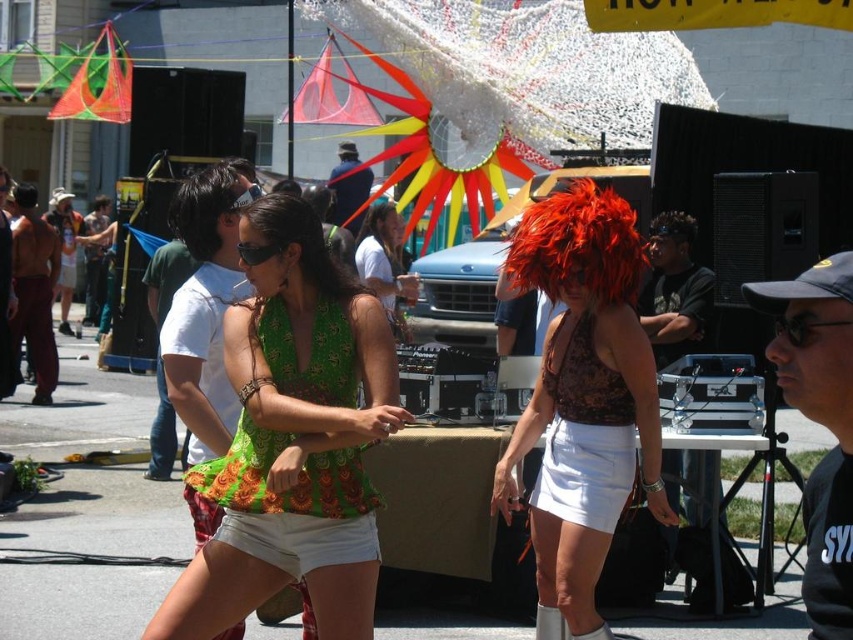
You are a photographer at the festival and want to capture both the green floral blouse at center and the green floral dress at center in a single frame. Which clothing item will appear taller in the photo?

The green floral blouse at center will appear taller in the photo since it has a greater height compared to the green floral dress at center according to the description.

You are a photographer at the festival trying to capture both the green floral dress at center and the satin black top at center in a single frame. Which clothing item should you focus on first if you want to ensure both are fully visible in your photo?

The green floral dress at center is shorter than the satin black top at center, so you should focus on the satin black top at center first to ensure it is fully visible in the frame.